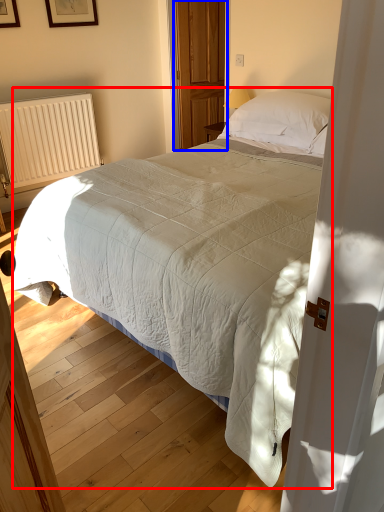
Question: Which object appears farthest to the camera in this image, bed (highlighted by a red box) or screen door (highlighted by a blue box)?

Choices:
 (A) bed
 (B) screen door

Answer: (B)